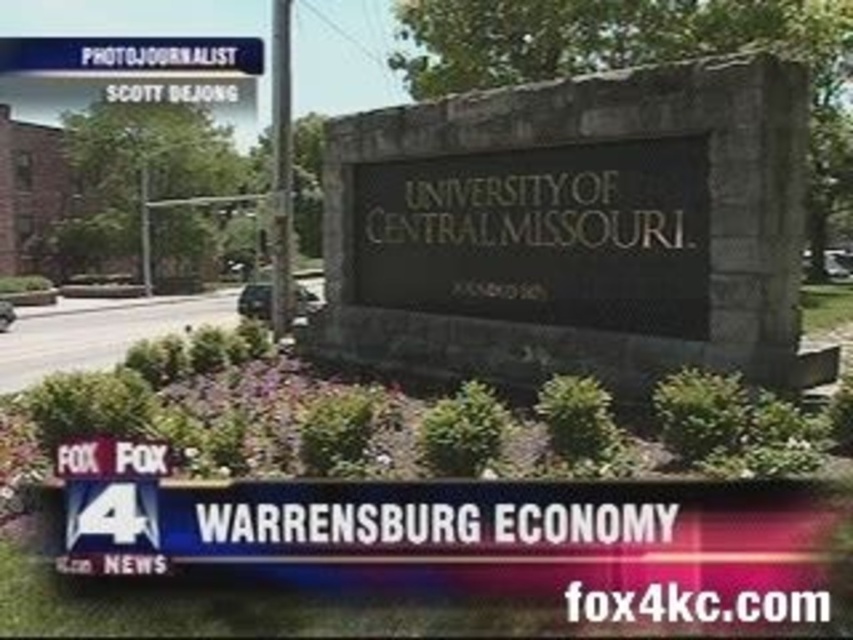
Between point (173, 49) and point (274, 289), which one is positioned behind?

Positioned behind is point (173, 49).

Can you confirm if black stone sign at center is wider than metallic pole at center?

Correct, the width of black stone sign at center exceeds that of metallic pole at center.

Locate an element on the screen. The width and height of the screenshot is (853, 640). black stone sign at center is located at coordinates (132, 52).

Locate an element on the screen. The width and height of the screenshot is (853, 640). black stone sign at center is located at coordinates (132, 52).